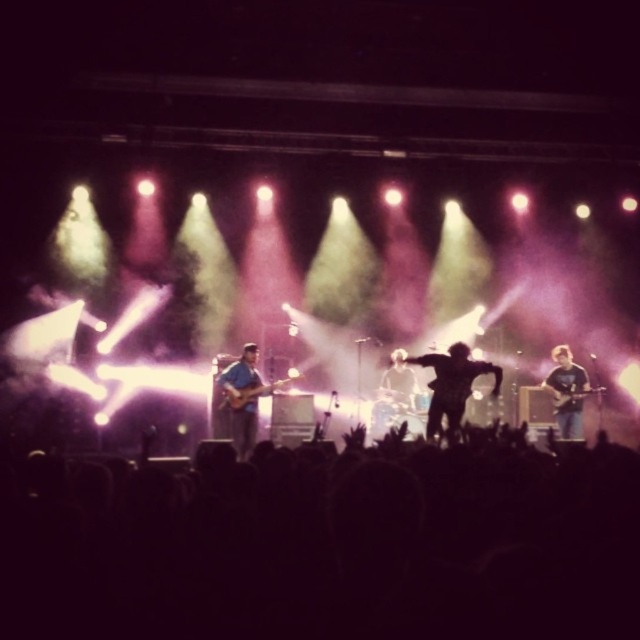
You are a photographer at the back of the venue trying to capture a clear shot of both the silhouette figure at center and the wooden acoustic guitar at right. Which one will appear larger in your photo?

The silhouette figure at center will appear larger in the photo because it is closer to the viewer than the wooden acoustic guitar at right.

You are attending a concert and want to take a photo of the silhouette figure at center. The camera you have can only focus on objects within a 0.15 unit radius around the point where you aim. If you aim your camera at the point given by the coordinates point (452, 385), will the silhouette figure at center be in focus?

The silhouette figure at center is represented by point (452, 385), so aiming the camera at that exact point will ensure the silhouette figure at center is within the 0.15 unit radius focus area, thus it will be in focus.

You are a stagehand who needs to place a new spotlight at point (x=243, y=397). Which object should you aim the spotlight at?

The point (x=243, y=397) corresponds to the matte blue guitar at center left, so you should aim the spotlight at the matte blue guitar at center left.